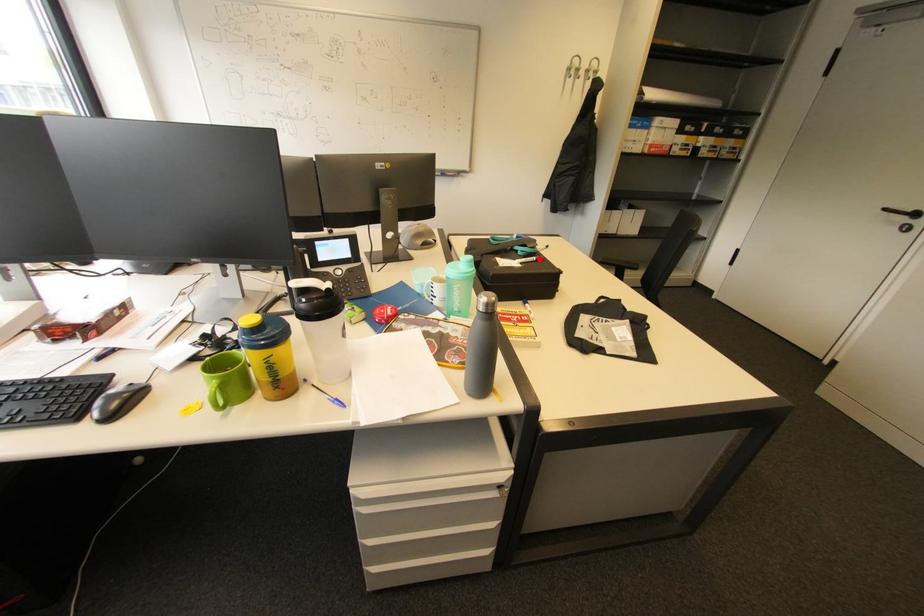
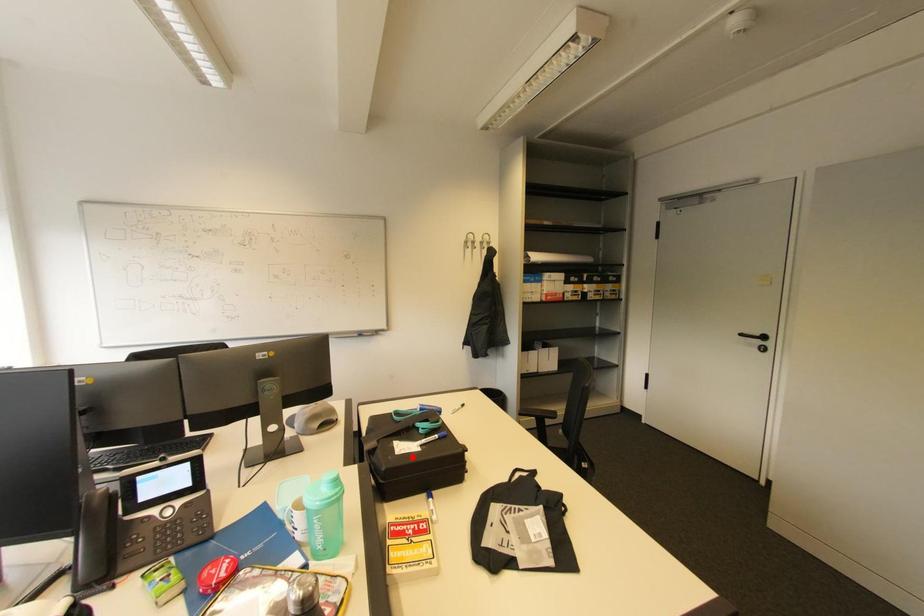
I am providing you with two images of the same scene from different viewpoints. A red point is marked on the first image and another point is marked on the second image. Does the point marked in image1 correspond to the same location as the one in image2?

No